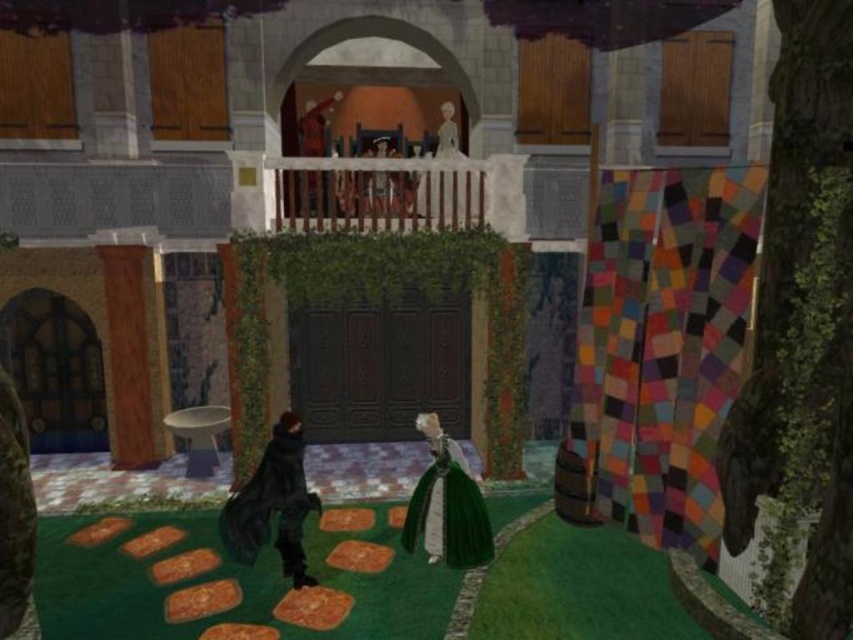
The height and width of the screenshot is (640, 853). Describe the element at coordinates (128, 355) in the screenshot. I see `wooden pillar at left` at that location.

Which of these two, wooden pillar at left or velvet green dress at lower center, stands shorter?

velvet green dress at lower center is shorter.

This screenshot has height=640, width=853. In order to click on wooden pillar at left in this screenshot , I will do `click(128, 355)`.

Does black matte coat at lower left have a lesser height compared to wooden pillar at left?

Yes.

Where is `black matte coat at lower left`? The image size is (853, 640). black matte coat at lower left is located at coordinates (271, 502).

Who is shorter, wooden pillar at left or white glossy statue at upper center?

white glossy statue at upper center is shorter.

This screenshot has height=640, width=853. What do you see at coordinates (128, 355) in the screenshot? I see `wooden pillar at left` at bounding box center [128, 355].

Where is `wooden pillar at left`? wooden pillar at left is located at coordinates (128, 355).